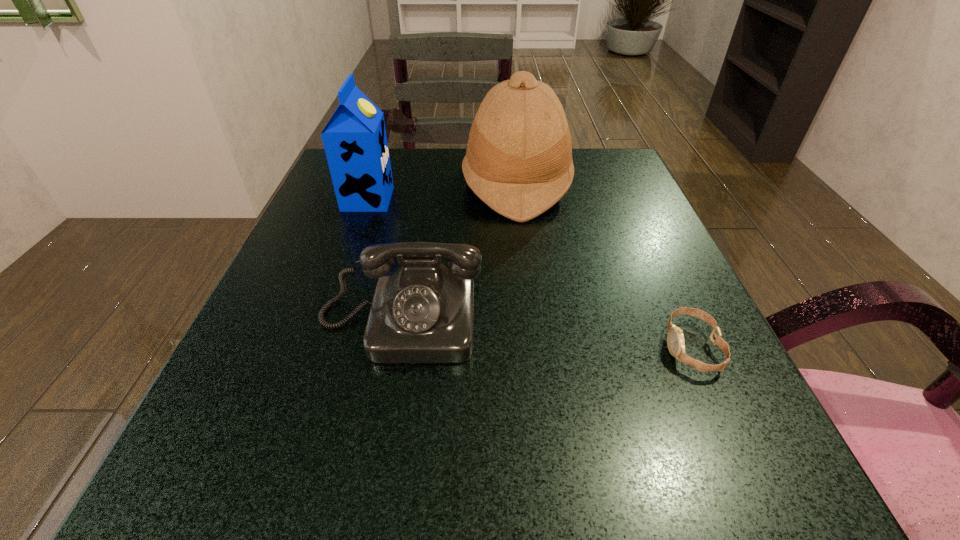
Image resolution: width=960 pixels, height=540 pixels. In order to click on vacant space located 0.200m on the face of the watch in this screenshot , I will do `click(532, 348)`.

Identify the location of vacant region located on the face of the watch. The width and height of the screenshot is (960, 540). (411, 348).

The height and width of the screenshot is (540, 960). What are the coordinates of `free space located on the face of the watch` in the screenshot? It's located at (559, 348).

You are a GUI agent. You are given a task and a screenshot of the screen. Output one action in this format:
    pyautogui.click(x=<x>, y=<y>)
    Task: Click on the hat that is at the far edge
    The width and height of the screenshot is (960, 540).
    Given the screenshot: What is the action you would take?
    pyautogui.click(x=518, y=161)

Identify the location of carton that is positioned at the far edge. (355, 142).

Locate an element on the screen. carton that is at the left edge is located at coordinates (355, 142).

Identify the location of telephone present at the left edge. (423, 312).

This screenshot has height=540, width=960. Find the location of `hat located in the right edge section of the desktop`. hat located in the right edge section of the desktop is located at coordinates (518, 161).

Where is `watch located in the right edge section of the desktop`? This screenshot has width=960, height=540. watch located in the right edge section of the desktop is located at coordinates (675, 339).

This screenshot has height=540, width=960. In order to click on object that is at the far left corner in this screenshot , I will do `click(355, 142)`.